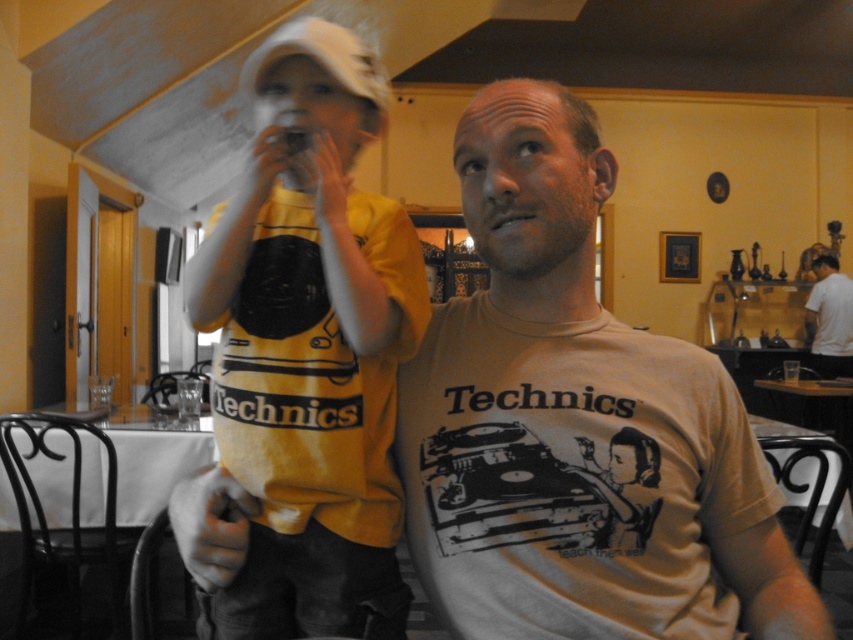
Who is lower down, matte beige t-shirt at center or white t-shirt at center?

Positioned lower is matte beige t-shirt at center.

Where is `matte beige t-shirt at center`? matte beige t-shirt at center is located at coordinates (576, 424).

Identify the location of matte beige t-shirt at center. This screenshot has width=853, height=640. (576, 424).